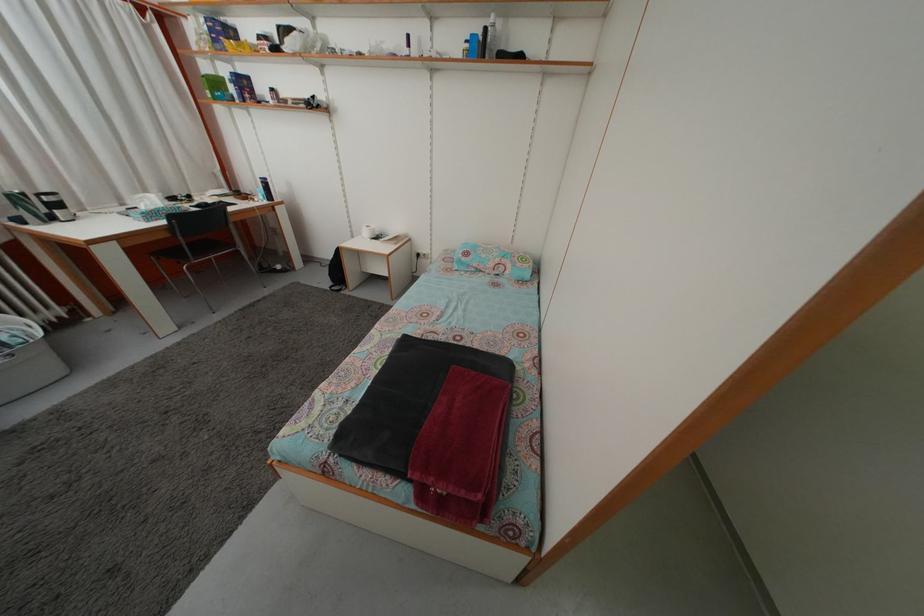
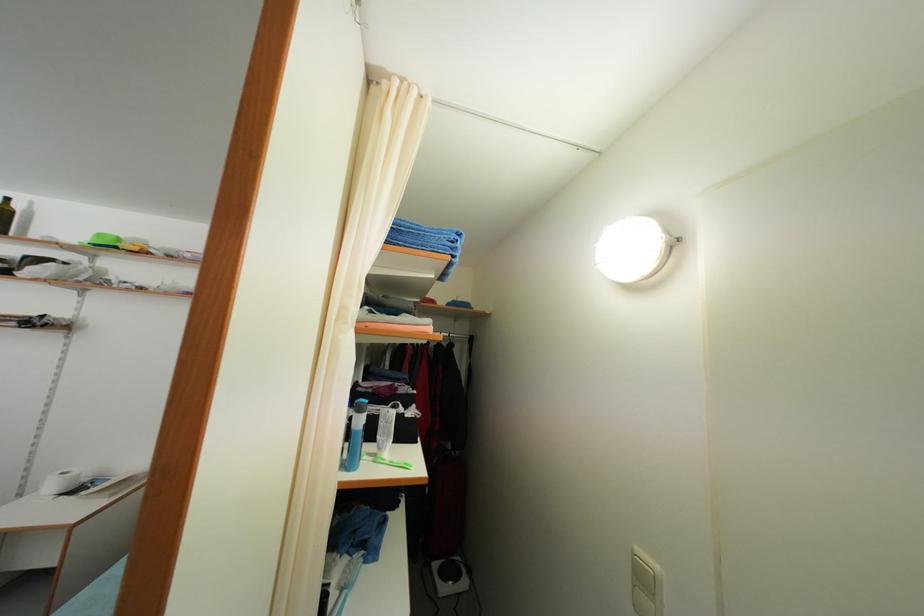
Find the pixel in the second image that matches point 371,240 in the first image.

(56, 493)